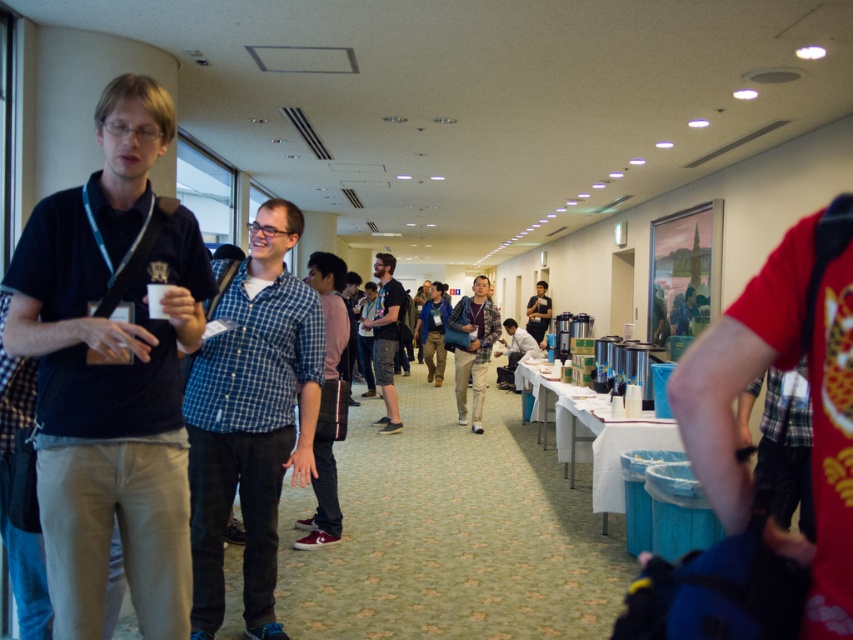
Is light brown fabric pants at center smaller than dark blue shirt at center?

Correct, light brown fabric pants at center occupies less space than dark blue shirt at center.

Who is higher up, light brown fabric pants at center or dark blue shirt at center?

dark blue shirt at center is higher up.

Does point (469, 330) lie behind point (386, 348)?

No, it is in front of (386, 348).

This screenshot has height=640, width=853. Identify the location of light brown fabric pants at center. (473, 348).

Describe the element at coordinates (112, 369) in the screenshot. I see `dark blue shirt at left` at that location.

Is point (148, 157) positioned after point (386, 289)?

That is False.

Locate an element on the screen. Image resolution: width=853 pixels, height=640 pixels. dark blue shirt at left is located at coordinates (112, 369).

At what (x,y) coordinates should I click in order to perform the action: click on dark blue shirt at left. Please return your answer as a coordinate pair (x, y). The width and height of the screenshot is (853, 640). Looking at the image, I should click on (112, 369).

Which is behind, point (480, 317) or point (427, 326)?

Positioned behind is point (427, 326).

Is light brown fabric pants at center smaller than blue denim jacket at center?

Indeed, light brown fabric pants at center has a smaller size compared to blue denim jacket at center.

I want to click on light brown fabric pants at center, so click(473, 348).